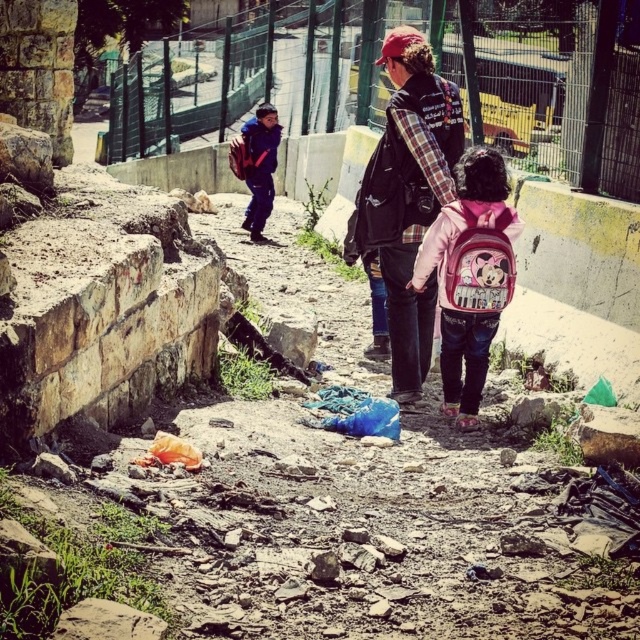
You are standing at the point with coordinates point (268, 184) and want to walk towards the point with coordinates point (497, 298). Since you are 1.7 meters tall, will you be able to see over the stone walls along the path between these two points?

Point (497, 298) is closer to the viewer than point (268, 184). Since you are 1.7 meters tall, you might be able to see over the stone walls along the path between these two points if the walls are not too tall. However, the exact visibility depends on the height of the walls, which isn